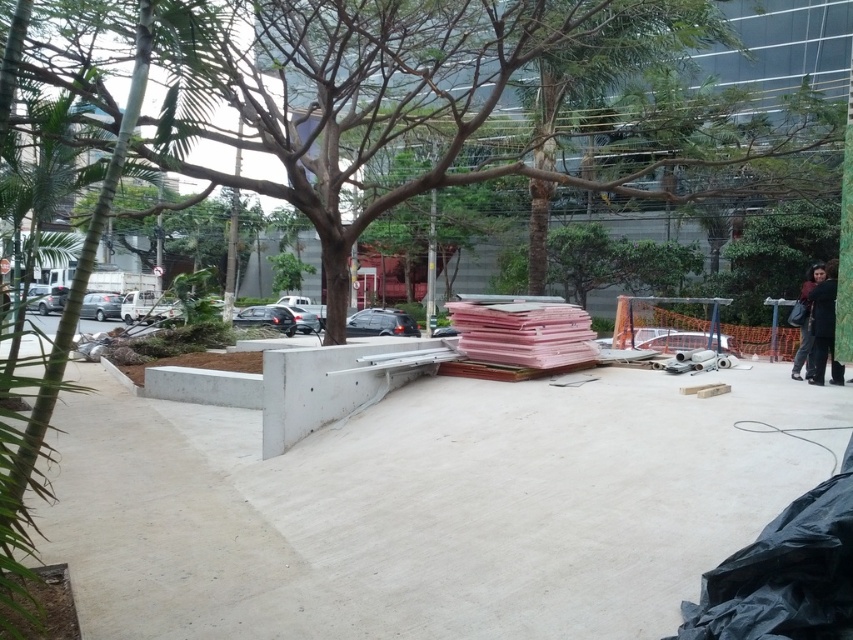
You are a delivery person who needs to place a heavy box on the ground in the outdoor urban scene. The box requires a stable and flat surface. Which location would be more suitable between the white smooth concrete at center and the dark gray fabric at right? Please explain your choice based on the scene description.

The white smooth concrete at center is more suitable because it has a larger size compared to the dark gray fabric at right, providing a more stable and flat surface for placing the heavy box.

You are a delivery person trying to park your 2.5 meter wide truck. You see the white smooth concrete at center and the dark gray fabric at right. Which object is shorter in height and can you fit your truck between them?

The white smooth concrete at center is not as tall as dark gray fabric at right. Since the truck is 2.5 meters wide, you can fit your truck between them if the distance between the two objects is at least 2.5 meters. However, the height of the objects does not affect the truck width. Please ensure the space between them is wide enough.